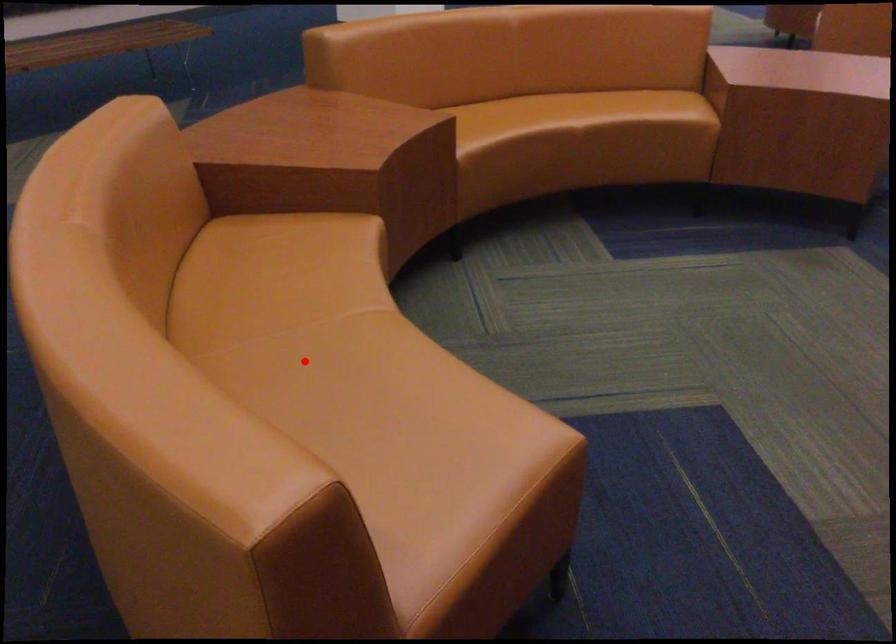
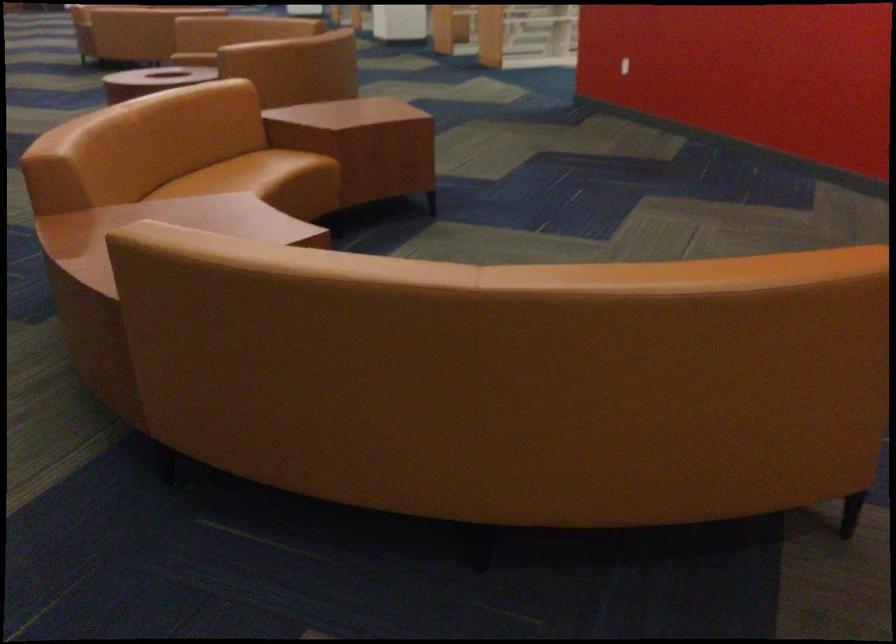
Question: I am providing you with two images of the same scene from different viewpoints. A red point is marked on the first image. Is the red point's position out of view in image 2?

Choices:
 (A) Yes
 (B) No

Answer: (A)